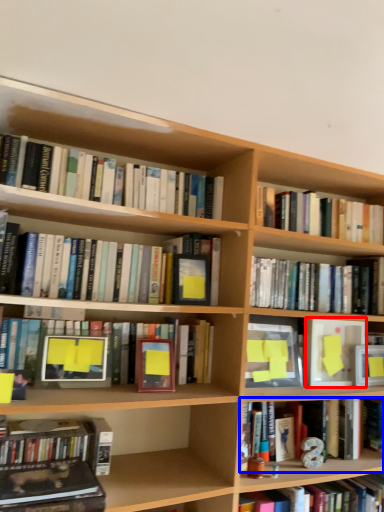
Question: Which object is further to the camera taking this photo, paperback book (highlighted by a red box) or book (highlighted by a blue box)?

Choices:
 (A) paperback book
 (B) book

Answer: (A)